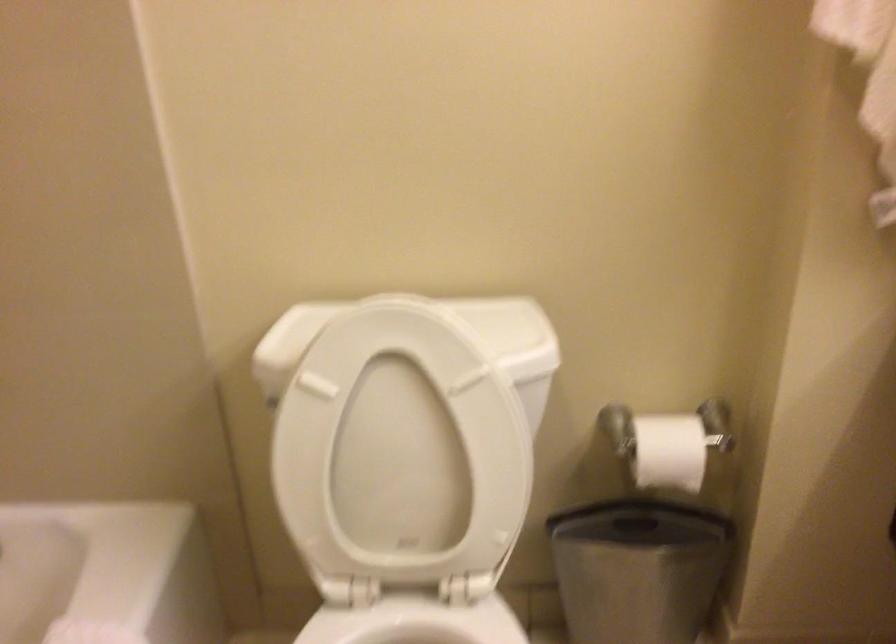
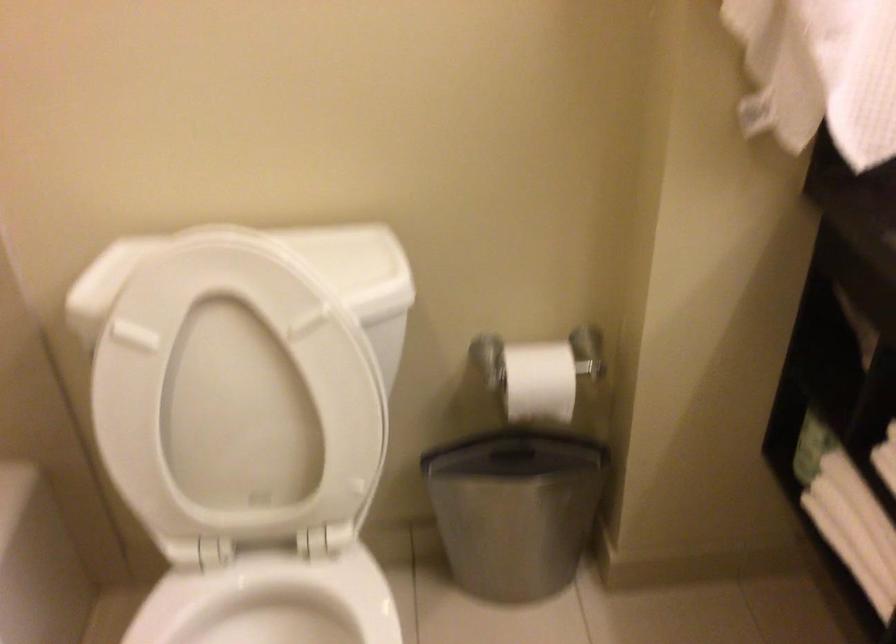
What movement of the cameraman would produce the second image?

The cameraman walked toward right, forward.